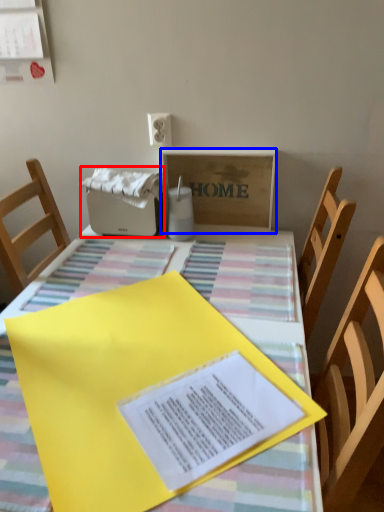
Question: Which point is closer to the camera, appliance (highlighted by a red box) or cardboard box (highlighted by a blue box)?

Choices:
 (A) appliance
 (B) cardboard box

Answer: (B)